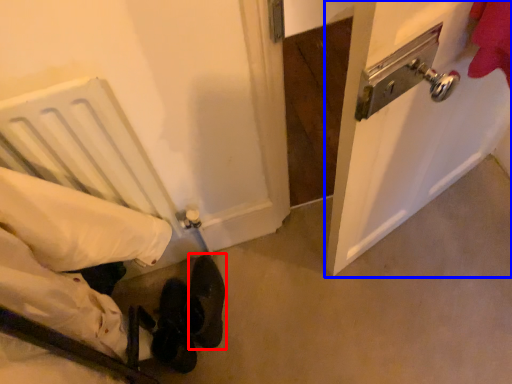
Question: Among these objects, which one is nearest to the camera, footwear (highlighted by a red box) or door (highlighted by a blue box)?

Choices:
 (A) footwear
 (B) door

Answer: (B)